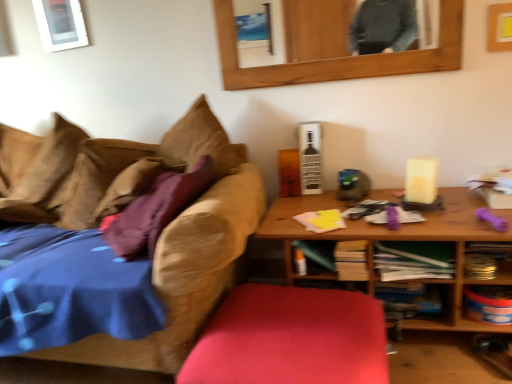
Question: Is wooden table at right inside the boundaries of green matte book at center, which is the 4th book in right-to-left order, or outside?

Choices:
 (A) inside
 (B) outside

Answer: (B)

Question: Is wooden table at right in front of or behind green matte book at center, the 1th book positioned from the left, in the image?

Choices:
 (A) front
 (B) behind

Answer: (A)

Question: Which of these objects is positioned closest to the yellow paper at center, acting as the second book starting from the left?

Choices:
 (A) textured brown couch at left
 (B) green paper at center, the 4th book from the left
 (C) smooth red cushion at center
 (D) green matte book at center, the 1th book positioned from the left
 (E) metallic silver canister at lower right, the 2th shelf viewed from the top

Answer: (D)

Question: Which of these objects is positioned closest to the white glossy picture frame at upper left, which appears as the 2th picture frame when viewed from the right?

Choices:
 (A) brown fabric pillow at left, which is the third pillow in right-to-left order
 (B) yellow paper at center, acting as the second book starting from the left
 (C) metallic silver canister at lower right, the 1th shelf in the bottom-to-top sequence
 (D) brown suede pillow at left, which ranks as the second pillow in left-to-right order
 (E) matte yellow picture frame at upper right, which is counted as the 1th picture frame, starting from the front

Answer: (A)